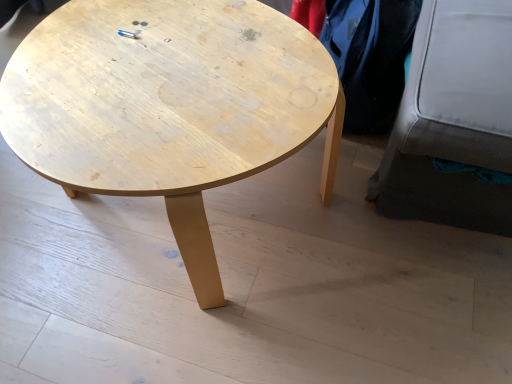
This screenshot has height=384, width=512. I want to click on vacant point above natural wood coffee table at center (from a real-world perspective), so click(x=170, y=72).